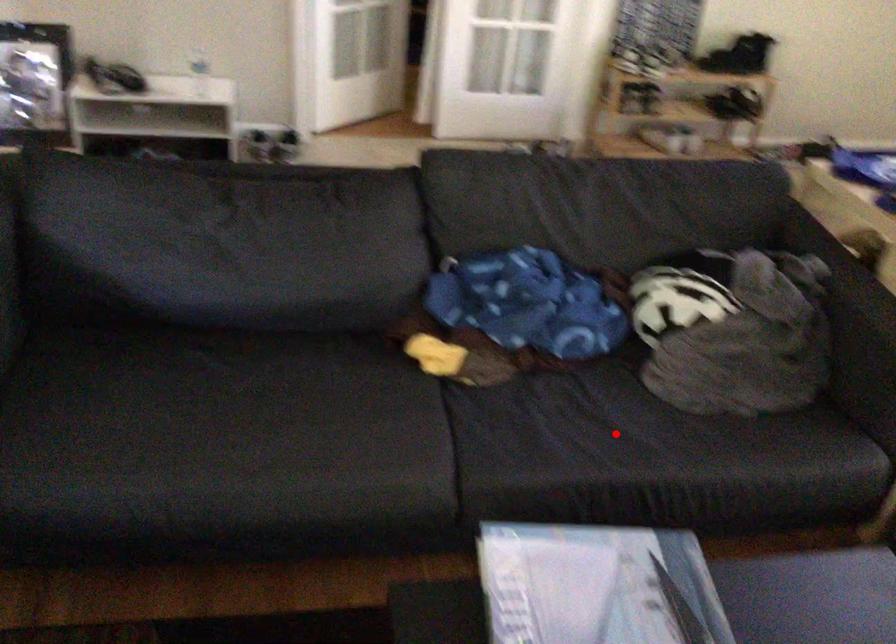
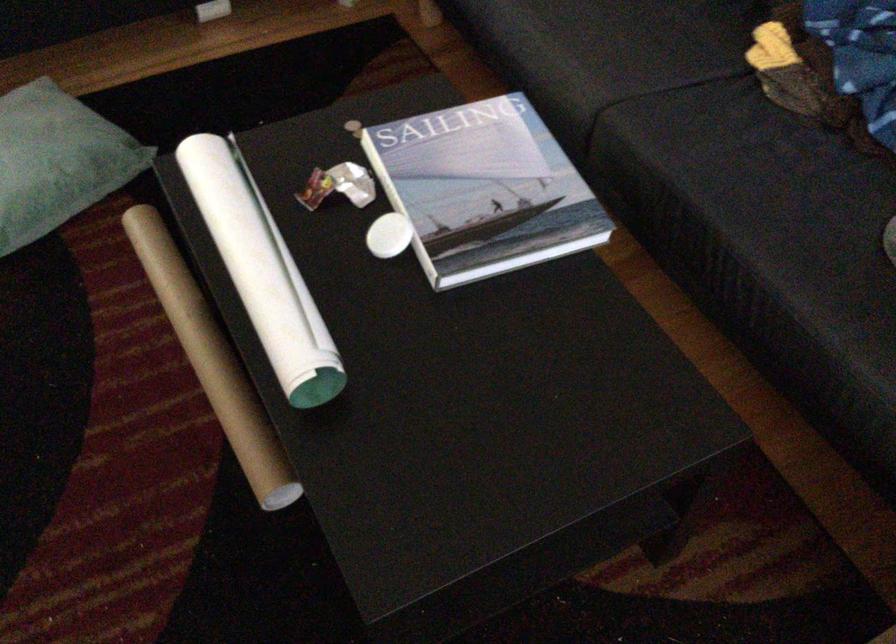
Question: I am providing you with two images of the same scene from different viewpoints. Image1 has a red point marked. In image2, the corresponding 3D location appears at what relative position? Reply with the corresponding letter.

Choices:
 (A) Closer
 (B) Farther

Answer: (A)